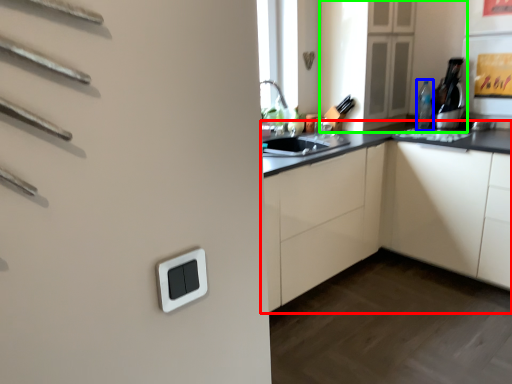
Question: Which object is positioned farthest from cabinetry (highlighted by a red box)? Select from bottle (highlighted by a blue box) and cabinetry (highlighted by a green box).

Choices:
 (A) bottle
 (B) cabinetry

Answer: (A)